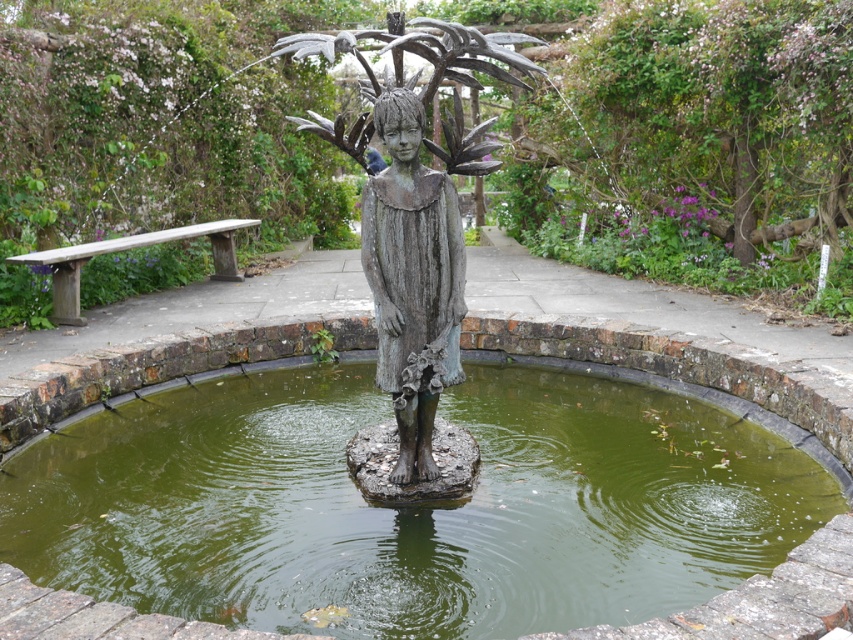
Question: Which of the following is the closest to the observer?

Choices:
 (A) (369, 195)
 (B) (833, 563)

Answer: (B)

Question: Which object appears closest to the camera in this image?

Choices:
 (A) rusty bronze statue at center
 (B) green murky water at center

Answer: (B)

Question: Which object appears closest to the camera in this image?

Choices:
 (A) rusty bronze statue at center
 (B) green murky water at center

Answer: (B)

Question: Does rusty bronze statue at center have a smaller size compared to green murky water at center?

Choices:
 (A) no
 (B) yes

Answer: (A)

Question: Considering the relative positions of rusty bronze statue at center and green murky water at center in the image provided, where is rusty bronze statue at center located with respect to green murky water at center?

Choices:
 (A) below
 (B) above

Answer: (B)

Question: Does rusty bronze statue at center come in front of green murky water at center?

Choices:
 (A) no
 (B) yes

Answer: (A)